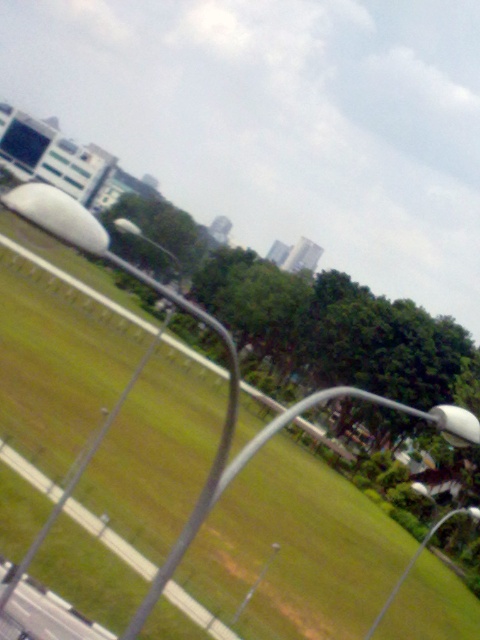
You are standing at the curved metallic structure in the foreground of the image. You see two points marked on the grassy area behind it. The first point is at coordinates point (73, 413) and the second is at point (400, 573). Which point is closer to you?

Point (73, 413) is closer to the viewer than point (400, 573).

You are a gardener who needs to mow the green grass at center and trim the white glossy lamp post at lower right. Which task should you do first if you want to tackle the taller object first?

The green grass at center is taller than the white glossy lamp post at lower right, so you should mow the green grass at center first.